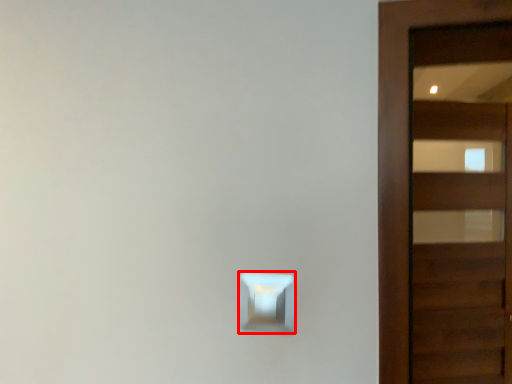
Question: From the image's perspective, where is light switch (annotated by the red box) located in relation to door in the image?

Choices:
 (A) above
 (B) below

Answer: (B)